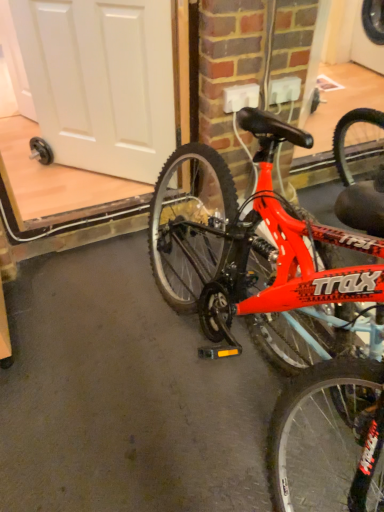
Describe the element at coordinates (283, 313) in the screenshot. This screenshot has width=384, height=512. I see `shiny red bicycle at center` at that location.

Measure the distance between point (369, 369) and camera.

Point (369, 369) and camera are 35.24 inches apart.

Where is `shiny red bicycle at center`? This screenshot has height=512, width=384. shiny red bicycle at center is located at coordinates (283, 313).

What do you see at coordinates (101, 81) in the screenshot? I see `white matte door at upper left` at bounding box center [101, 81].

In order to click on white matte door at upper left in this screenshot , I will do `click(101, 81)`.

Where is `shiny red bicycle at center`? The height and width of the screenshot is (512, 384). shiny red bicycle at center is located at coordinates (283, 313).

In the image, is shiny red bicycle at center on the left side or the right side of white matte door at upper left?

Based on their positions, shiny red bicycle at center is located to the right of white matte door at upper left.

Which object is more forward, shiny red bicycle at center or white matte door at upper left?

shiny red bicycle at center is in front.

Is point (367, 286) less distant than point (101, 164)?

Yes.

From the image's perspective, is shiny red bicycle at center positioned above or below white matte door at upper left?

shiny red bicycle at center is situated lower than white matte door at upper left in the image.

From a real-world perspective, which is physically above, shiny red bicycle at center or white matte door at upper left?

From a 3D spatial view, white matte door at upper left is above.

Is shiny red bicycle at center wider than white matte door at upper left?

Correct, the width of shiny red bicycle at center exceeds that of white matte door at upper left.

Can you confirm if shiny red bicycle at center is shorter than white matte door at upper left?

In fact, shiny red bicycle at center may be taller than white matte door at upper left.

Between shiny red bicycle at center and white matte door at upper left, which one has larger size?

shiny red bicycle at center is bigger.

Is white matte door at upper left surrounded by shiny red bicycle at center?

Definitely not — white matte door at upper left is not inside shiny red bicycle at center.

Is shiny red bicycle at center not near white matte door at upper left?

Actually, shiny red bicycle at center and white matte door at upper left are a little close together.

Does shiny red bicycle at center turn towards white matte door at upper left?

No.

What's the angular difference between shiny red bicycle at center and white matte door at upper left's facing directions?

They differ by 43.4 degrees in their facing directions.

You are a GUI agent. You are given a task and a screenshot of the screen. Output one action in this format:
    pyautogui.click(x=<x>, y=<y>)
    Task: Click on the bicycle that is in front of the white matte door at upper left
    
    Given the screenshot: What is the action you would take?
    pyautogui.click(x=283, y=313)

From the picture: Is white matte door at upper left to the left or to the right of shiny red bicycle at center in the image?

Based on their positions, white matte door at upper left is located to the left of shiny red bicycle at center.

Who is more distant, white matte door at upper left or shiny red bicycle at center?

white matte door at upper left is further from the camera.

Which is closer to the camera, (118, 66) or (349, 476)?

Point (118, 66) appears to be farther away from the viewer than point (349, 476).

From the image's perspective, is white matte door at upper left under shiny red bicycle at center?

No, from the image's perspective, white matte door at upper left is not below shiny red bicycle at center.

From a real-world perspective, is white matte door at upper left on shiny red bicycle at center?

Yes, from a real-world perspective, white matte door at upper left is on top of shiny red bicycle at center.

Does white matte door at upper left have a lesser width compared to shiny red bicycle at center?

Yes, white matte door at upper left is thinner than shiny red bicycle at center.

Based on the photo, considering the relative sizes of white matte door at upper left and shiny red bicycle at center in the image provided, is white matte door at upper left taller than shiny red bicycle at center?

No.

Is white matte door at upper left bigger or smaller than shiny red bicycle at center?

In the image, white matte door at upper left appears to be smaller than shiny red bicycle at center.

Is white matte door at upper left completely or partially outside of shiny red bicycle at center?

Indeed, white matte door at upper left is completely outside shiny red bicycle at center.

Are white matte door at upper left and shiny red bicycle at center far apart?

white matte door at upper left is near shiny red bicycle at center, not far away.

Is shiny red bicycle at center at the back of white matte door at upper left?

white matte door at upper left is not turned away from shiny red bicycle at center.

Identify the location of screen door that appears above the shiny red bicycle at center (from a real-world perspective). (101, 81).

Identify the location of screen door that appears on the left of shiny red bicycle at center. This screenshot has height=512, width=384. (101, 81).

The width and height of the screenshot is (384, 512). Find the location of `bicycle below the white matte door at upper left (from the image's perspective)`. bicycle below the white matte door at upper left (from the image's perspective) is located at coordinates (283, 313).